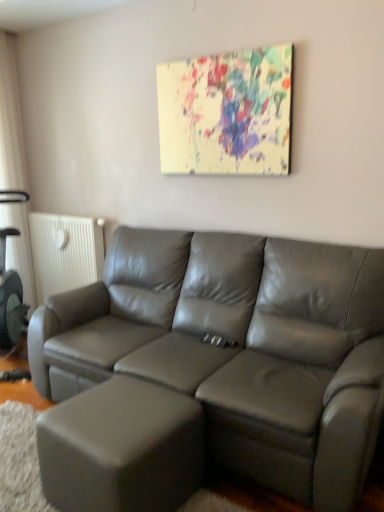
Question: From a real-world perspective, is white textured radiator at left under painted canvas at upper center?

Choices:
 (A) no
 (B) yes

Answer: (B)

Question: Is white textured radiator at left closer to camera compared to painted canvas at upper center?

Choices:
 (A) yes
 (B) no

Answer: (B)

Question: Considering the relative sizes of white textured radiator at left and painted canvas at upper center in the image provided, is white textured radiator at left shorter than painted canvas at upper center?

Choices:
 (A) yes
 (B) no

Answer: (B)

Question: From the image's perspective, is white textured radiator at left above painted canvas at upper center?

Choices:
 (A) yes
 (B) no

Answer: (B)

Question: From a real-world perspective, is white textured radiator at left located higher than painted canvas at upper center?

Choices:
 (A) yes
 (B) no

Answer: (B)

Question: Choose the correct answer: Is matte gray ottoman at lower left inside white textured radiator at left or outside it?

Choices:
 (A) outside
 (B) inside

Answer: (A)

Question: From a real-world perspective, relative to white textured radiator at left, is matte gray ottoman at lower left vertically above or below?

Choices:
 (A) above
 (B) below

Answer: (B)

Question: Considering the positions of matte gray ottoman at lower left and white textured radiator at left in the image, is matte gray ottoman at lower left taller or shorter than white textured radiator at left?

Choices:
 (A) short
 (B) tall

Answer: (A)

Question: In terms of width, does matte gray ottoman at lower left look wider or thinner when compared to white textured radiator at left?

Choices:
 (A) thin
 (B) wide

Answer: (B)

Question: Would you say painted canvas at upper center is to the left or to the right of white textured radiator at left in the picture?

Choices:
 (A) right
 (B) left

Answer: (A)

Question: Considering the positions of painted canvas at upper center and white textured radiator at left in the image, is painted canvas at upper center bigger or smaller than white textured radiator at left?

Choices:
 (A) small
 (B) big

Answer: (A)

Question: Is painted canvas at upper center taller or shorter than white textured radiator at left?

Choices:
 (A) tall
 (B) short

Answer: (B)

Question: Considering the positions of painted canvas at upper center and white textured radiator at left in the image, is painted canvas at upper center wider or thinner than white textured radiator at left?

Choices:
 (A) wide
 (B) thin

Answer: (B)

Question: In the image, is painted canvas at upper center on the left side or the right side of matte gray ottoman at lower left?

Choices:
 (A) right
 (B) left

Answer: (A)

Question: Choose the correct answer: Is painted canvas at upper center inside matte gray ottoman at lower left or outside it?

Choices:
 (A) inside
 (B) outside

Answer: (B)